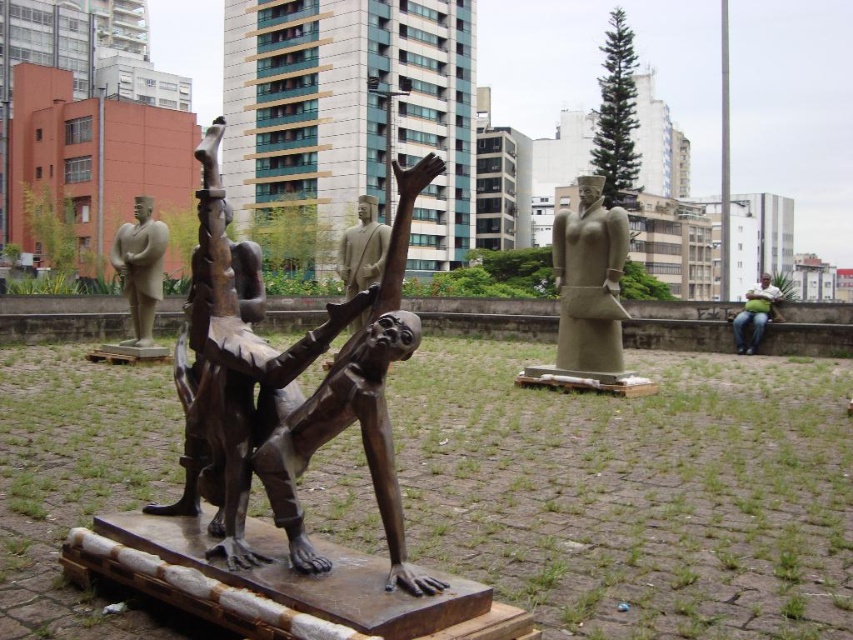
You are an art student who wants to sketch the bronze statue at center and the green fabric bag at right. Since you have limited paper space, you need to know which object is narrower to prioritize. Which one is narrower?

The bronze statue at center is narrower than the green fabric bag at right according to the description.

You are standing in front of the public art installation and want to take a photo of both point (x=279, y=465) and point (x=738, y=317). Which point should you focus on first to ensure both are in the frame?

You should focus on point (x=279, y=465) first since it is closer to the camera and will help ensure both points are in the frame.